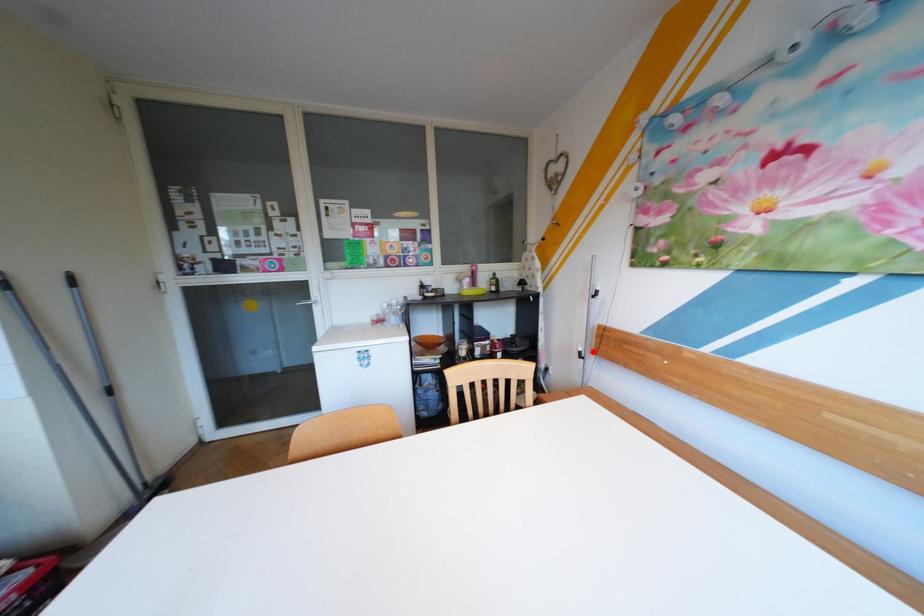
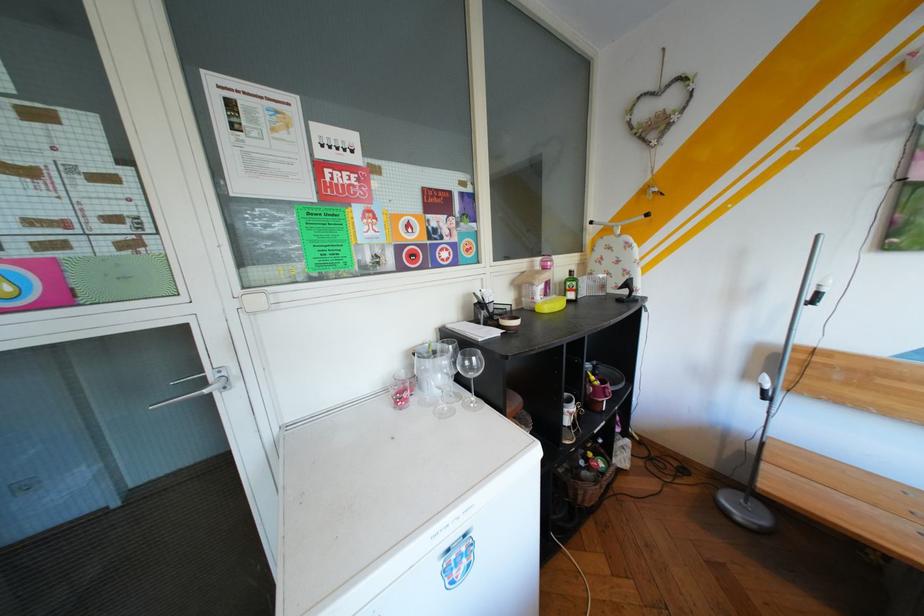
In the second image, find the point that corresponds to the highlighted location in the first image.

(776, 390)